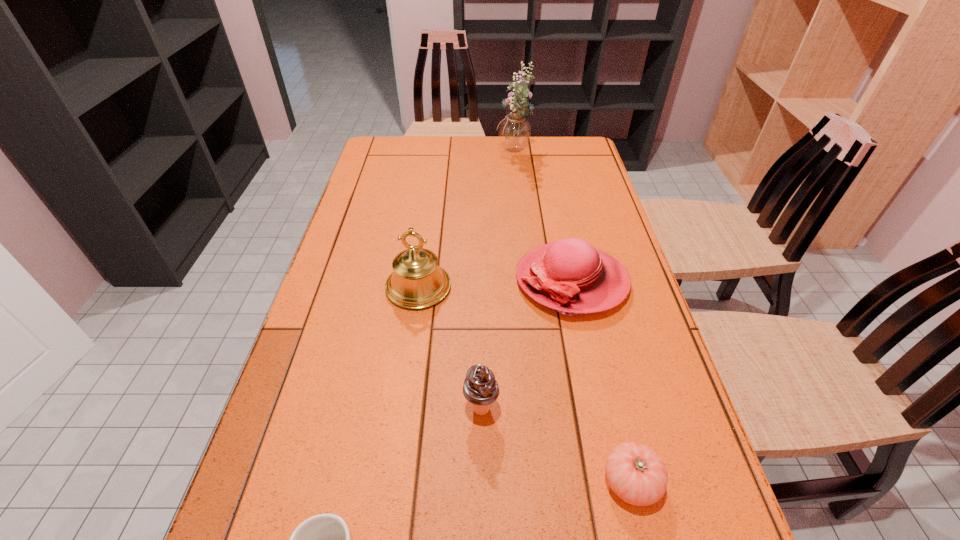
Locate an element on the screen. The image size is (960, 540). vacant space situated on the back of the bell is located at coordinates (429, 212).

Where is `free space located on the right of the third tallest object`? free space located on the right of the third tallest object is located at coordinates (639, 409).

Where is `free space located at the front of the fourth tallest object with a bow`? free space located at the front of the fourth tallest object with a bow is located at coordinates (360, 280).

Find the location of a particular element. This screenshot has height=540, width=960. free space located 0.320m at the front of the fourth tallest object with a bow is located at coordinates (392, 280).

Where is `vacant space located at the front of the fourth tallest object with a bow`? vacant space located at the front of the fourth tallest object with a bow is located at coordinates (430, 280).

In order to click on vacant space positioned on the left of the tomato in this screenshot , I will do `click(522, 482)`.

Identify the location of object that is at the far edge. (514, 134).

I want to click on object situated at the left edge, so click(417, 282).

At what (x,y) coordinates should I click in order to perform the action: click on hat that is at the right edge. Please return your answer as a coordinate pair (x, y). Looking at the image, I should click on (570, 276).

The image size is (960, 540). Find the location of `tomato that is at the right edge`. tomato that is at the right edge is located at coordinates (635, 472).